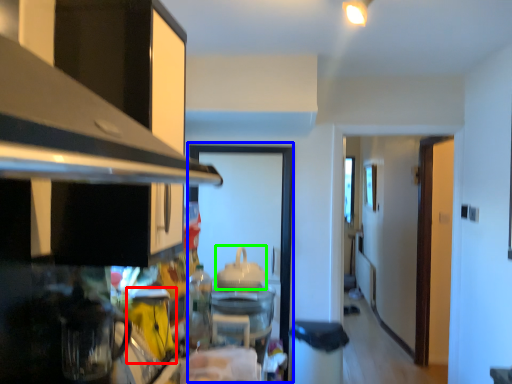
Question: Estimate the real-world distances between objects in this image. Which object is closer to appliance (highlighted by a red box), glass door (highlighted by a blue box) or appliance (highlighted by a green box)?

Choices:
 (A) glass door
 (B) appliance

Answer: (B)